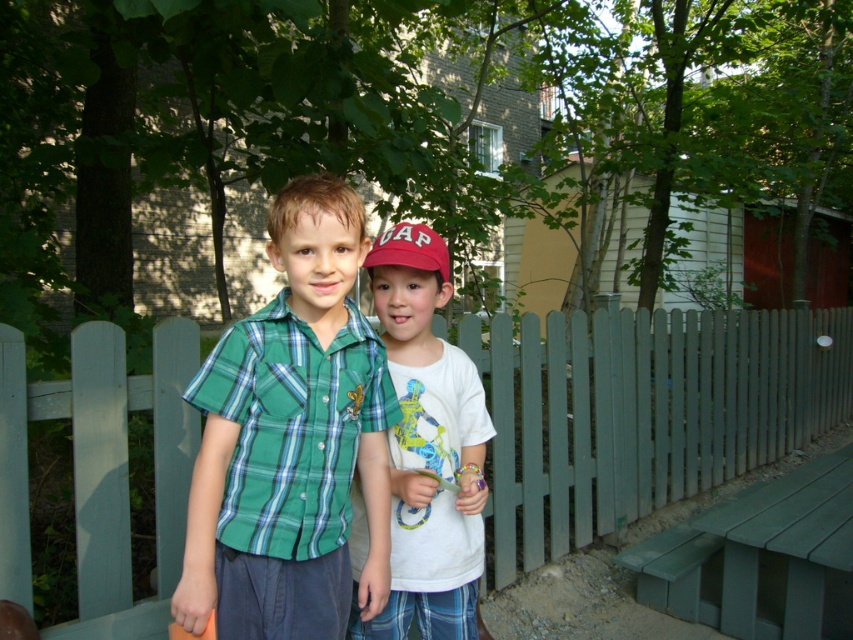
Question: Is white matte t-shirt at center closer to camera compared to green painted wood park bench at lower right?

Choices:
 (A) no
 (B) yes

Answer: (B)

Question: Which of the following is the farthest from the observer?

Choices:
 (A) green painted wood park bench at lower right
 (B) green wooden fence at center

Answer: (B)

Question: Is green wooden fence at center closer to camera compared to white matte t-shirt at center?

Choices:
 (A) yes
 (B) no

Answer: (B)

Question: Which point is closer to the camera?

Choices:
 (A) (445, 262)
 (B) (793, 348)

Answer: (A)

Question: Which point is closer to the camera taking this photo?

Choices:
 (A) (292, 502)
 (B) (397, 262)
 (C) (399, 444)

Answer: (A)

Question: Does green plaid shirt at center come behind matte red baseball cap at center?

Choices:
 (A) yes
 (B) no

Answer: (B)